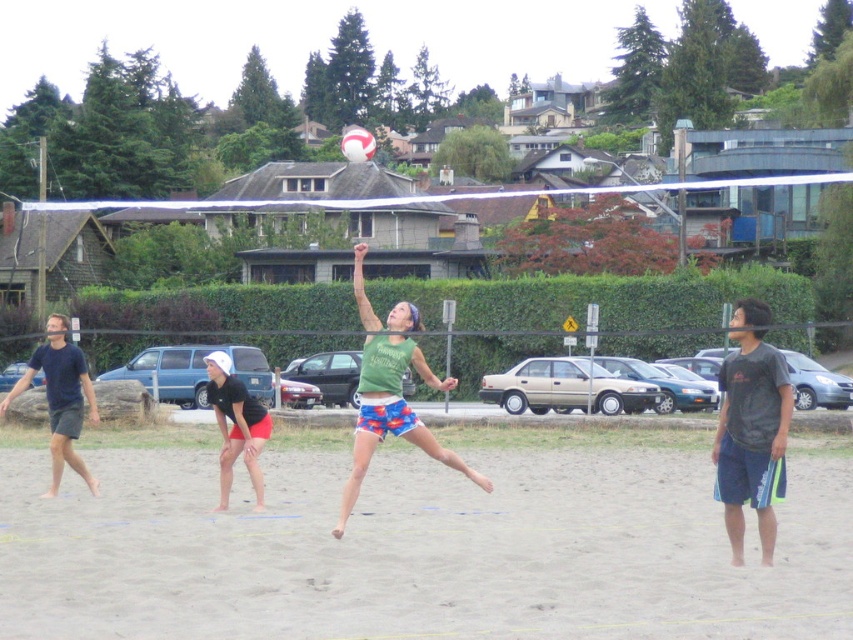
Does dark blue t-shirt at left lie behind matte black shorts at lower left?

Yes.

At what (x,y) coordinates should I click in order to perform the action: click on dark blue t-shirt at left. Please return your answer as a coordinate pair (x, y). Looking at the image, I should click on (61, 397).

Find the location of a particular element. This screenshot has width=853, height=640. green fabric tank top at center is located at coordinates (390, 392).

Does green fabric tank top at center have a larger size compared to white matte volleyball at center?

Actually, green fabric tank top at center might be smaller than white matte volleyball at center.

What do you see at coordinates (390, 392) in the screenshot? I see `green fabric tank top at center` at bounding box center [390, 392].

Locate an element on the screen. This screenshot has width=853, height=640. green fabric tank top at center is located at coordinates (390, 392).

Is point (746, 308) positioned before point (268, 422)?

Yes, it is.

Is dark gray t-shirt at right taller than matte black shorts at lower left?

Correct, dark gray t-shirt at right is much taller as matte black shorts at lower left.

Does point (747, 456) come closer to viewer compared to point (239, 426)?

Yes, it is in front of point (239, 426).

You are a GUI agent. You are given a task and a screenshot of the screen. Output one action in this format:
    pyautogui.click(x=<x>, y=<y>)
    Task: Click on the dark gray t-shirt at right
    
    Given the screenshot: What is the action you would take?
    pyautogui.click(x=751, y=429)